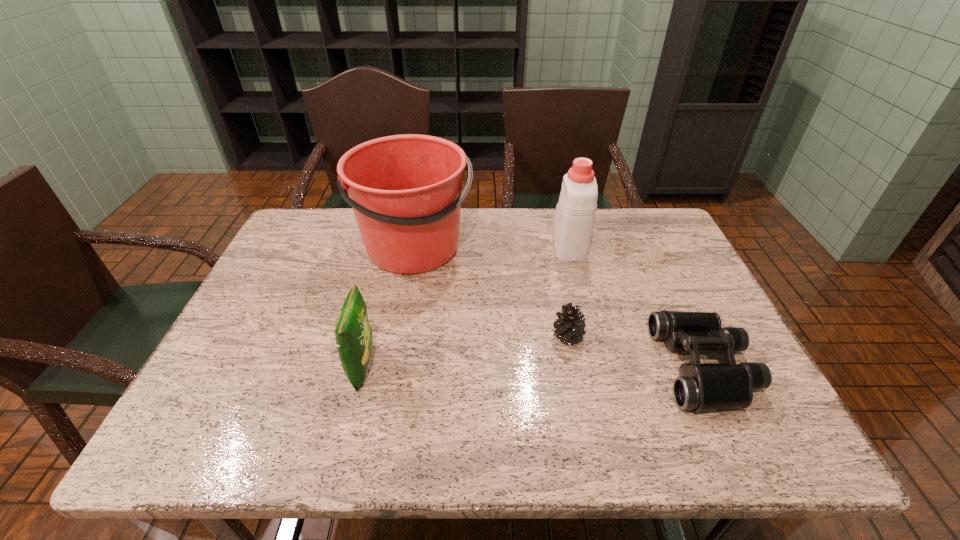
Where is `free region located on the back of the pinecone`? This screenshot has width=960, height=540. free region located on the back of the pinecone is located at coordinates (549, 241).

This screenshot has height=540, width=960. In order to click on free space located on the front-facing side of the rightmost object in this screenshot , I will do `click(638, 367)`.

The width and height of the screenshot is (960, 540). Find the location of `vacant region located 0.150m on the front-facing side of the rightmost object`. vacant region located 0.150m on the front-facing side of the rightmost object is located at coordinates (593, 367).

Identify the location of free location located on the front-facing side of the rightmost object. (512, 367).

Identify the location of bucket situated at the far edge. The height and width of the screenshot is (540, 960). (406, 192).

Where is `detergent at the far edge`? The image size is (960, 540). detergent at the far edge is located at coordinates (574, 217).

Find the location of a particular element. Image resolution: width=960 pixels, height=540 pixels. object that is at the near edge is located at coordinates (700, 386).

The height and width of the screenshot is (540, 960). Find the location of `object at the right edge`. object at the right edge is located at coordinates (700, 386).

In order to click on object located at the near right corner in this screenshot , I will do `click(700, 386)`.

You are a GUI agent. You are given a task and a screenshot of the screen. Output one action in this format:
    pyautogui.click(x=<x>, y=<y>)
    Task: Click on the vacant space at the far edge of the desktop
    This screenshot has width=960, height=540.
    Given the screenshot: What is the action you would take?
    pyautogui.click(x=551, y=222)